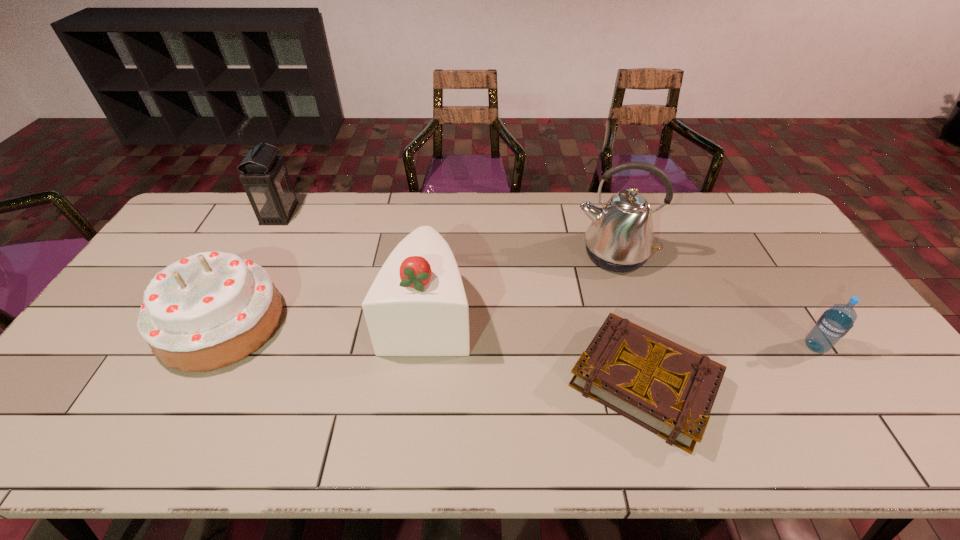
Where is `blank space located 0.370m on the left of the kettle`? Image resolution: width=960 pixels, height=540 pixels. blank space located 0.370m on the left of the kettle is located at coordinates (458, 254).

Locate an element on the screen. The height and width of the screenshot is (540, 960). free space located 0.210m on the back of the taller cake is located at coordinates (436, 233).

What are the coordinates of `vacant space located on the right of the shorter cake` in the screenshot? It's located at (348, 323).

Where is `free space located on the back of the rightmost object`? free space located on the back of the rightmost object is located at coordinates (785, 301).

Locate an element on the screen. vacant space located on the back of the shortest object is located at coordinates (608, 260).

Where is `lantern that is positioned at the far edge`? The width and height of the screenshot is (960, 540). lantern that is positioned at the far edge is located at coordinates (265, 179).

Where is `kettle at the far edge`? This screenshot has height=540, width=960. kettle at the far edge is located at coordinates (620, 238).

Identify the location of object that is positioned at the near edge. The height and width of the screenshot is (540, 960). (668, 389).

This screenshot has height=540, width=960. Find the location of `object that is at the left edge`. object that is at the left edge is located at coordinates (212, 309).

This screenshot has height=540, width=960. In order to click on object at the right edge in this screenshot , I will do `click(834, 323)`.